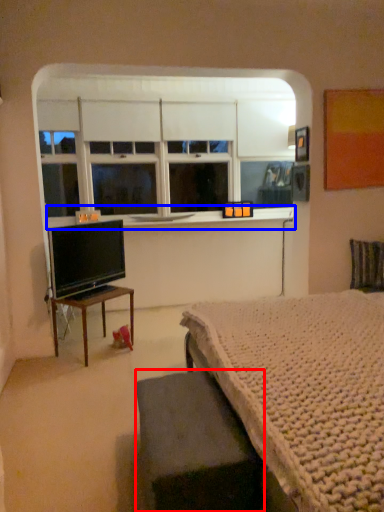
Question: Which of the following is the closest to the observer, table (highlighted by a red box) or window sill (highlighted by a blue box)?

Choices:
 (A) table
 (B) window sill

Answer: (A)